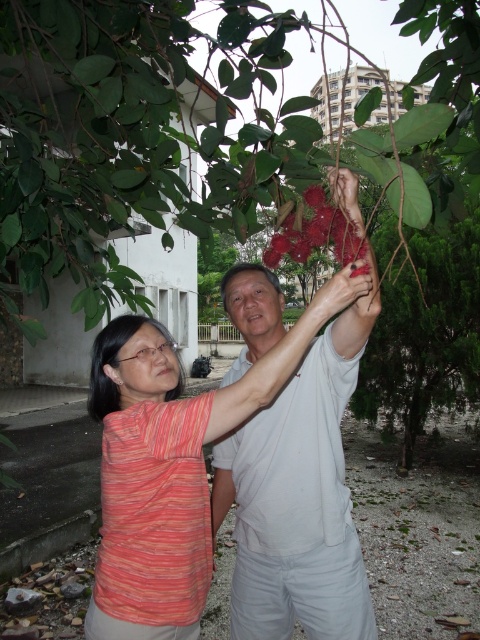
You are a photographer trying to capture both the striped cotton shirt at center and the white cotton shirt at center in a single frame. Based on their heights, which shirt should you focus on first to ensure both are fully visible in the photo?

The striped cotton shirt at center is shorter than the white cotton shirt at center, so you should focus on positioning the camera to include the taller white cotton shirt at center first, ensuring the shorter striped cotton shirt at center is also fully visible in the frame.

You are a fruit picker trying to reach the glossy red fruit at upper center and the glossy red flower at center. Which one is higher up in the tree?

The glossy red fruit at upper center is much taller than the glossy red flower at center, so it is higher up in the tree.

You are a delivery robot that needs to deliver a package to the person wearing the white cotton shirt at center. The robot has a maximum reach of 2 meters. Can the robot reach the person from its current position near the glossy red fruit at upper center?

The glossy red fruit at upper center is 2.77 meters away from the white cotton shirt at center. Since the robot can only reach up to 2 meters, it cannot reach the person wearing the white cotton shirt at center from its current position near the glossy red fruit at upper center.